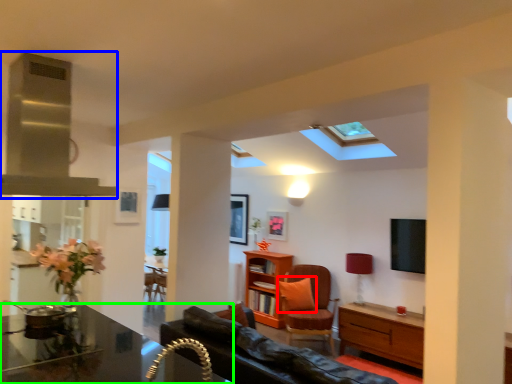
Question: Which object is the closest to the pillow (highlighted by a red box)? Choose among these: exhaust hood (highlighted by a blue box) or desk (highlighted by a green box).

Choices:
 (A) exhaust hood
 (B) desk

Answer: (B)